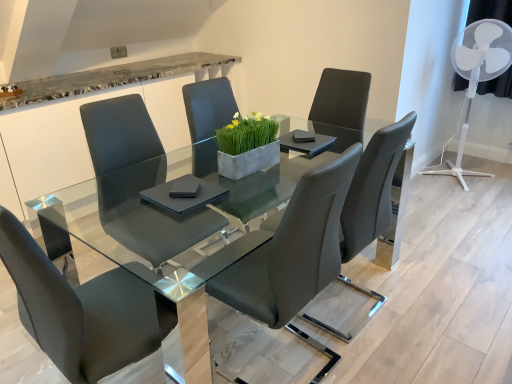
Locate an element on the screen. This screenshot has height=384, width=512. vacant area to the right of matte black chair at center, the 2th chair when ordered from right to left is located at coordinates (391, 349).